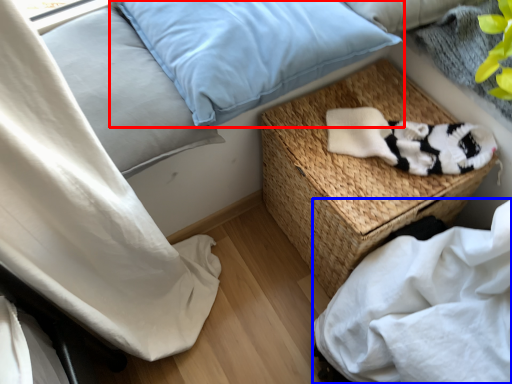
Question: Which of the following is the farthest to the observer, pillow (highlighted by a red box) or sheet (highlighted by a blue box)?

Choices:
 (A) pillow
 (B) sheet

Answer: (A)